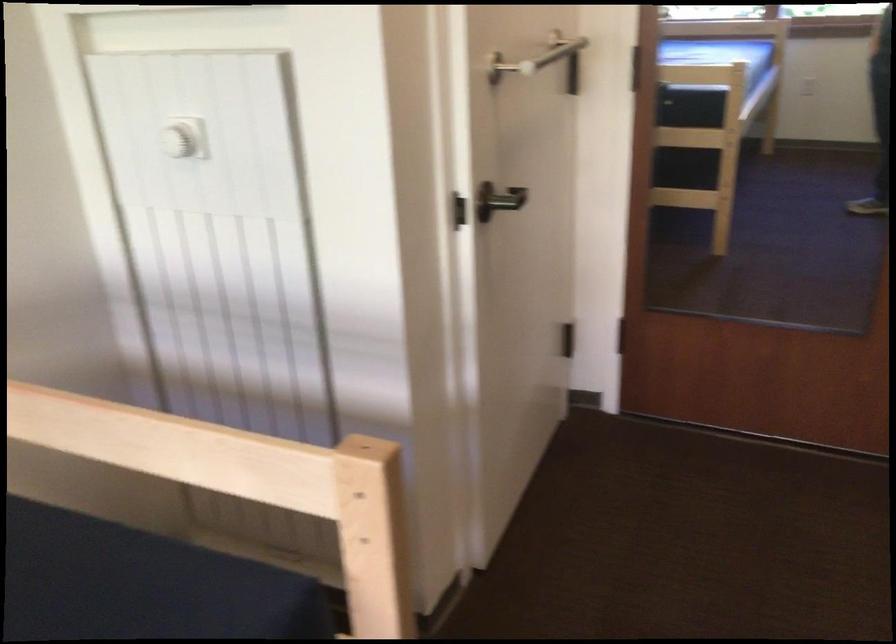
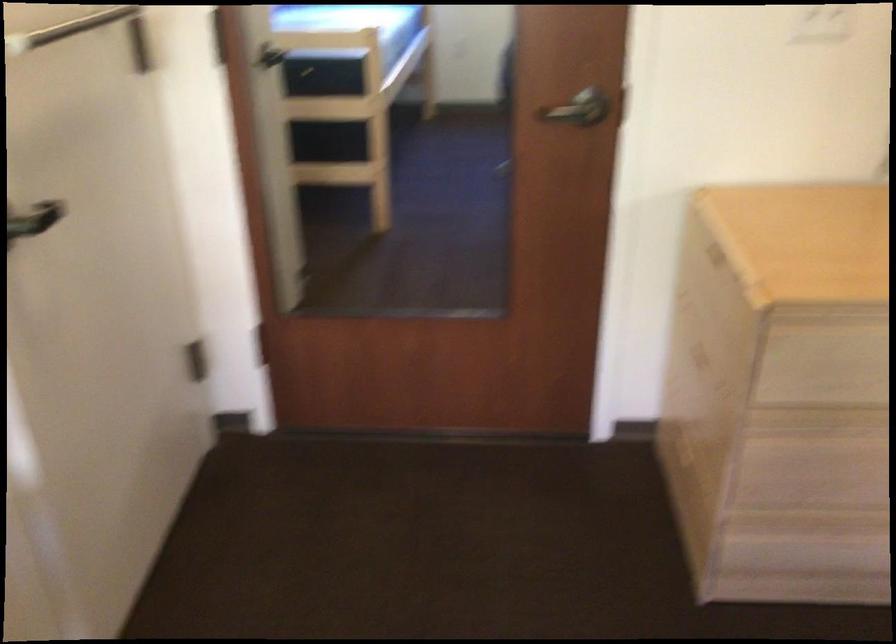
In a continuous first-person perspective shot, in which direction is the camera moving?

The cameraman moved toward right, forward.